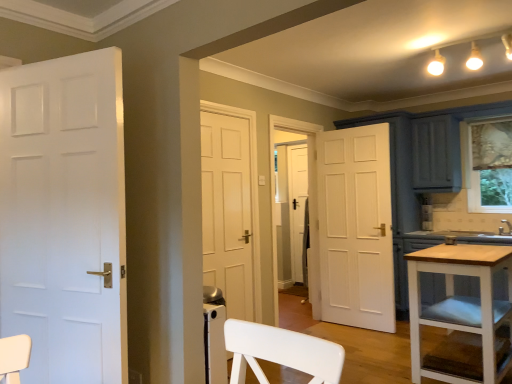
Question: Visually, is white matte door at left positioned to the left or to the right of white wood table at lower right?

Choices:
 (A) right
 (B) left

Answer: (B)

Question: In the image, is white matte door at left positioned in front of or behind white wood table at lower right?

Choices:
 (A) front
 (B) behind

Answer: (A)

Question: From a real-world perspective, is white matte door at left above or below white wood table at lower right?

Choices:
 (A) below
 (B) above

Answer: (B)

Question: In terms of height, does white wood table at lower right look taller or shorter compared to white matte door at left?

Choices:
 (A) short
 (B) tall

Answer: (A)

Question: Is white wood table at lower right spatially inside white matte door at left, or outside of it?

Choices:
 (A) outside
 (B) inside

Answer: (A)

Question: In the image, is white wood table at lower right on the left side or the right side of white matte door at left?

Choices:
 (A) left
 (B) right

Answer: (B)

Question: In terms of width, does white wood table at lower right look wider or thinner when compared to white matte door at left?

Choices:
 (A) thin
 (B) wide

Answer: (B)